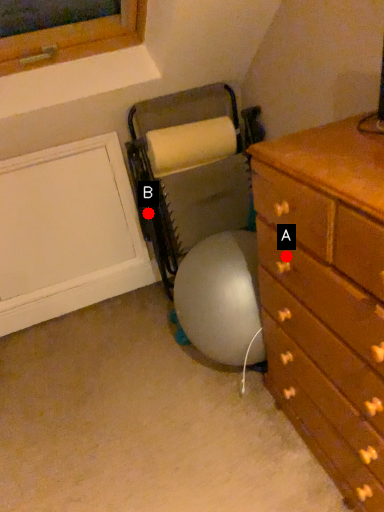
Question: Two points are circled on the image, labeled by A and B beside each circle. Which of the following is the closest to the observer?

Choices:
 (A) A is closer
 (B) B is closer

Answer: (A)